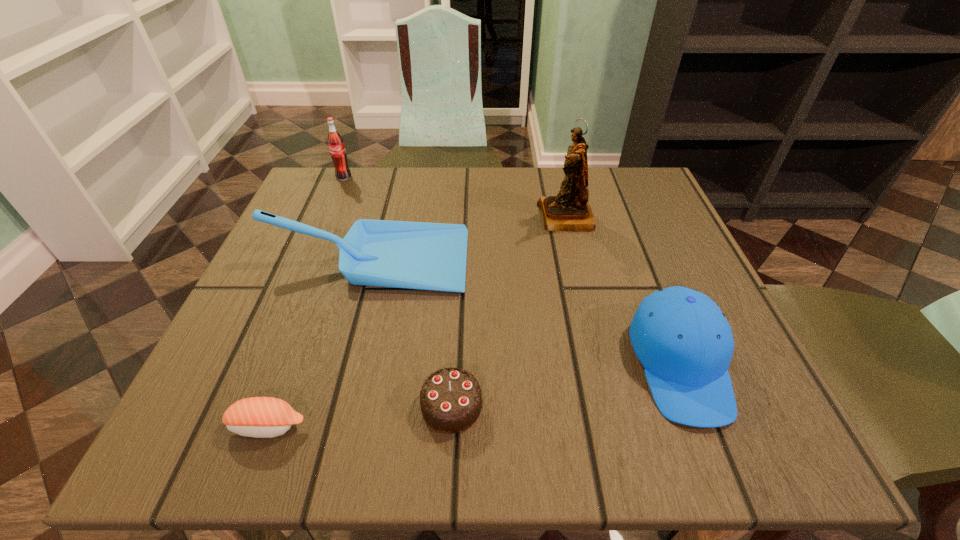
This screenshot has height=540, width=960. I want to click on free location at the far left corner of the desktop, so click(x=349, y=168).

What are the coordinates of `vacant space at the far right corner of the desktop` in the screenshot? It's located at (611, 168).

In the image, there is a desktop. Where is `vacant space at the near right corner`? This screenshot has height=540, width=960. vacant space at the near right corner is located at coordinates (744, 409).

You are a GUI agent. You are given a task and a screenshot of the screen. Output one action in this format:
    pyautogui.click(x=<x>, y=<y>)
    Task: Click on the blank region between the second tallest object and the cap
    
    Given the screenshot: What is the action you would take?
    pyautogui.click(x=512, y=271)

You are a GUI agent. You are given a task and a screenshot of the screen. Output one action in this format:
    pyautogui.click(x=<x>, y=<y>)
    Task: Click on the unoccupied area between the soda bottle and the chocolate cake
    This screenshot has height=540, width=960.
    Given the screenshot: What is the action you would take?
    pyautogui.click(x=397, y=292)

Where is `unoccupied position between the tallest object and the shortest object`? The width and height of the screenshot is (960, 540). unoccupied position between the tallest object and the shortest object is located at coordinates (417, 321).

Identify the location of free space between the dustpan and the fifth shortest object. The image size is (960, 540). (356, 219).

You are a GUI agent. You are given a task and a screenshot of the screen. Output one action in this format:
    pyautogui.click(x=<x>, y=<y>)
    Task: Click on the free space between the farthest object and the fifth tallest object
    The image size is (960, 540).
    Given the screenshot: What is the action you would take?
    pyautogui.click(x=397, y=292)

Identify the location of unoccupied area between the fifth tallest object and the figurine. This screenshot has height=540, width=960. (509, 312).

This screenshot has height=540, width=960. What are the coordinates of `free space between the chocolate cake and the dustpan` in the screenshot? It's located at (410, 333).